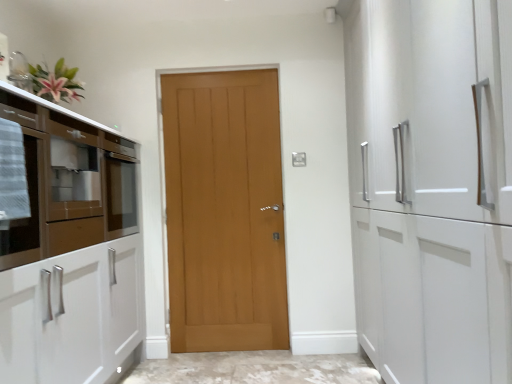
Question: Does point (256, 332) appear closer or farther from the camera than point (109, 278)?

Choices:
 (A) farther
 (B) closer

Answer: (A)

Question: From the image's perspective, is light brown wood door at center located above or below matte glass cabinet at left?

Choices:
 (A) below
 (B) above

Answer: (A)

Question: From a real-world perspective, relative to matte glass cabinet at left, is light brown wood door at center vertically above or below?

Choices:
 (A) below
 (B) above

Answer: (A)

Question: Is matte glass cabinet at left situated inside light brown wood door at center or outside?

Choices:
 (A) outside
 (B) inside

Answer: (A)

Question: From the image's perspective, is matte glass cabinet at left positioned above or below light brown wood door at center?

Choices:
 (A) above
 (B) below

Answer: (A)

Question: Considering the positions of matte glass cabinet at left and light brown wood door at center in the image, is matte glass cabinet at left wider or thinner than light brown wood door at center?

Choices:
 (A) thin
 (B) wide

Answer: (B)

Question: Does point (75, 157) appear closer or farther from the camera than point (251, 122)?

Choices:
 (A) closer
 (B) farther

Answer: (A)